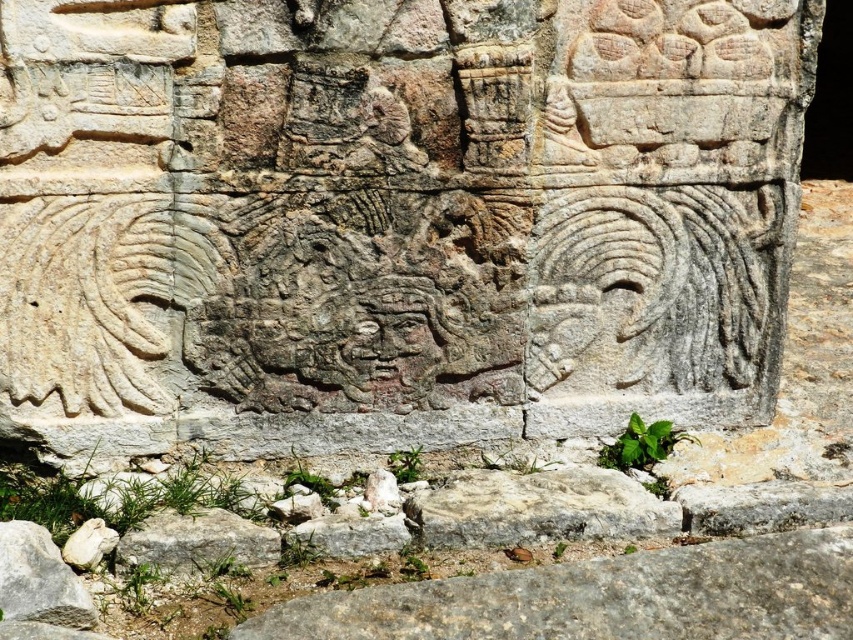
In the scene shown: Between gray stone carving at center and white stone at lower center, which one has less height?

white stone at lower center is shorter.

Who is more forward, (795, 131) or (170, 534)?

Point (170, 534) is more forward.

The image size is (853, 640). Find the location of `gray stone carving at center`. gray stone carving at center is located at coordinates (396, 212).

Does point (140, 563) lie behind point (82, 621)?

Yes.

Between white stone at lower center and gray rough stone at lower left, which one is positioned higher?

white stone at lower center is above.

Who is more distant from viewer, (241, 536) or (25, 544)?

Positioned behind is point (241, 536).

Where is `white stone at lower center`? The image size is (853, 640). white stone at lower center is located at coordinates (196, 541).

Who is more distant from viewer, (x=608, y=628) or (x=199, y=516)?

Positioned behind is point (x=199, y=516).

Can you confirm if gray rough stone at lower center is shorter than white stone at lower center?

In fact, gray rough stone at lower center may be taller than white stone at lower center.

I want to click on gray rough stone at lower center, so click(602, 596).

Identify the location of gray rough stone at lower center. (602, 596).